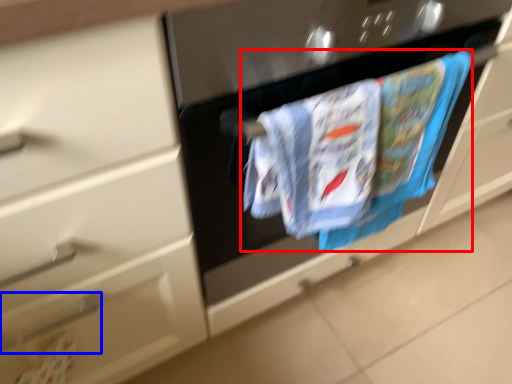
Question: Among these objects, which one is farthest to the camera, laundry (highlighted by a red box) or door handle (highlighted by a blue box)?

Choices:
 (A) laundry
 (B) door handle

Answer: (B)